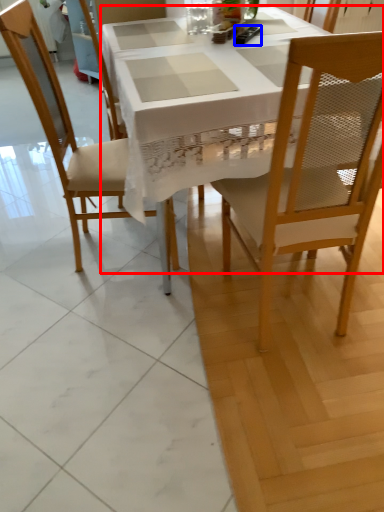
Question: Which object appears farthest to the camera in this image, desk (highlighted by a red box) or remote control (highlighted by a blue box)?

Choices:
 (A) desk
 (B) remote control

Answer: (B)